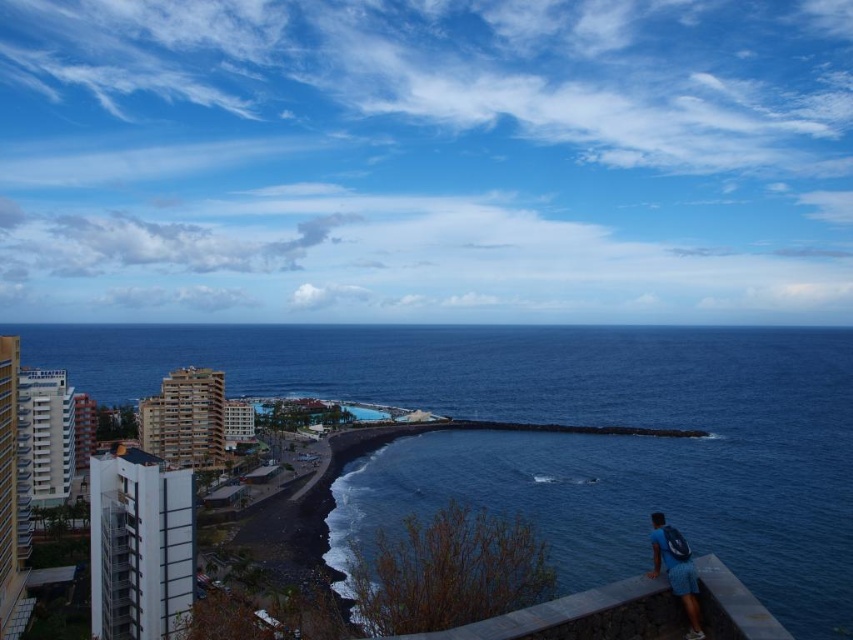
Question: Which object is closer to the camera taking this photo?

Choices:
 (A) gray concrete ledge at lower right
 (B) blue fabric backpack at lower right

Answer: (A)

Question: Is blue water at center to the right of blue fabric backpack at lower right from the viewer's perspective?

Choices:
 (A) yes
 (B) no

Answer: (B)

Question: Which point appears closest to the camera in this image?

Choices:
 (A) (596, 604)
 (B) (688, 566)
 (C) (833, 522)

Answer: (A)

Question: In this image, where is blue water at center located relative to gray concrete ledge at lower right?

Choices:
 (A) below
 (B) above

Answer: (B)

Question: Which of these objects is positioned farthest from the blue fabric backpack at lower right?

Choices:
 (A) gray concrete ledge at lower right
 (B) blue water at center

Answer: (B)

Question: Is gray concrete ledge at lower right wider than blue fabric backpack at lower right?

Choices:
 (A) yes
 (B) no

Answer: (A)